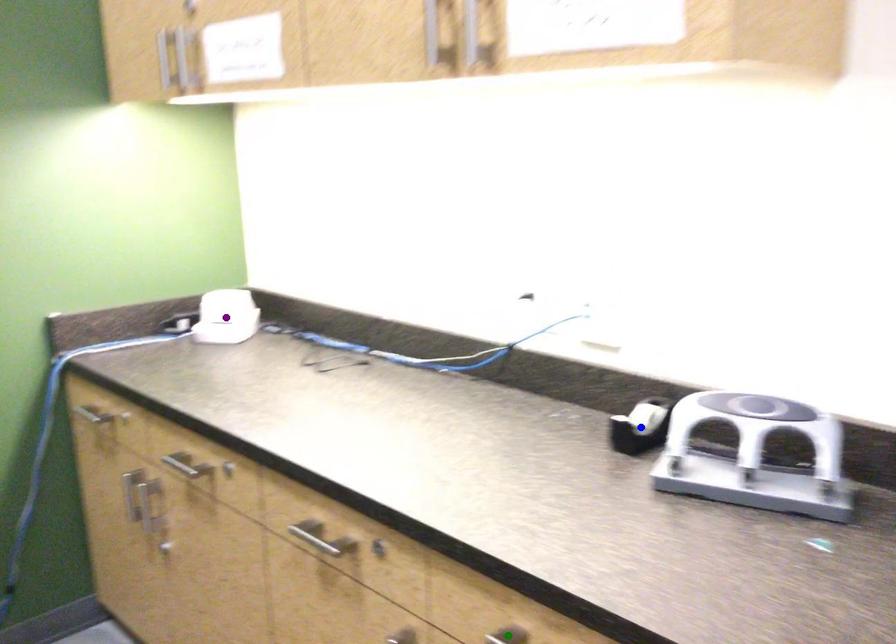
Order these from nearest to farthest:
purple point, blue point, green point

green point, blue point, purple point